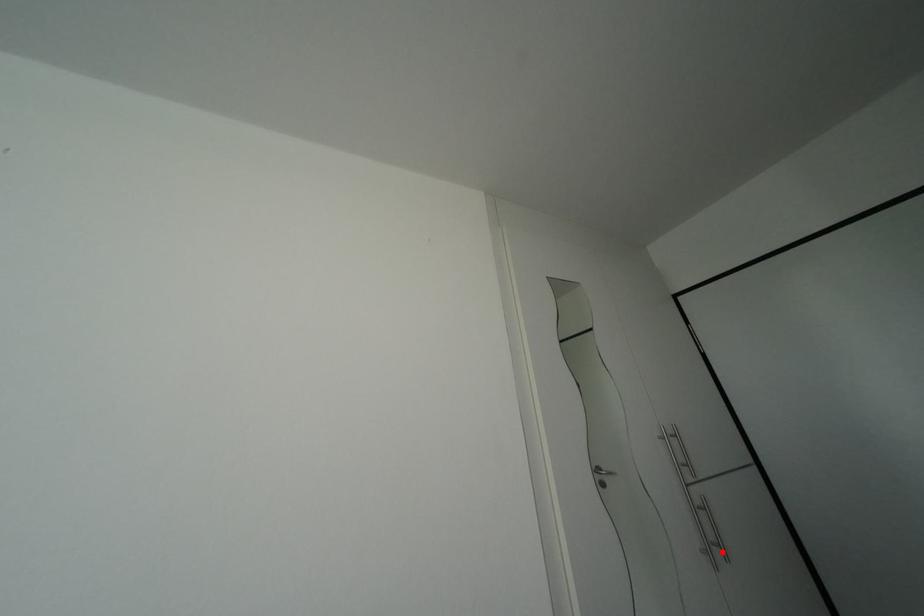
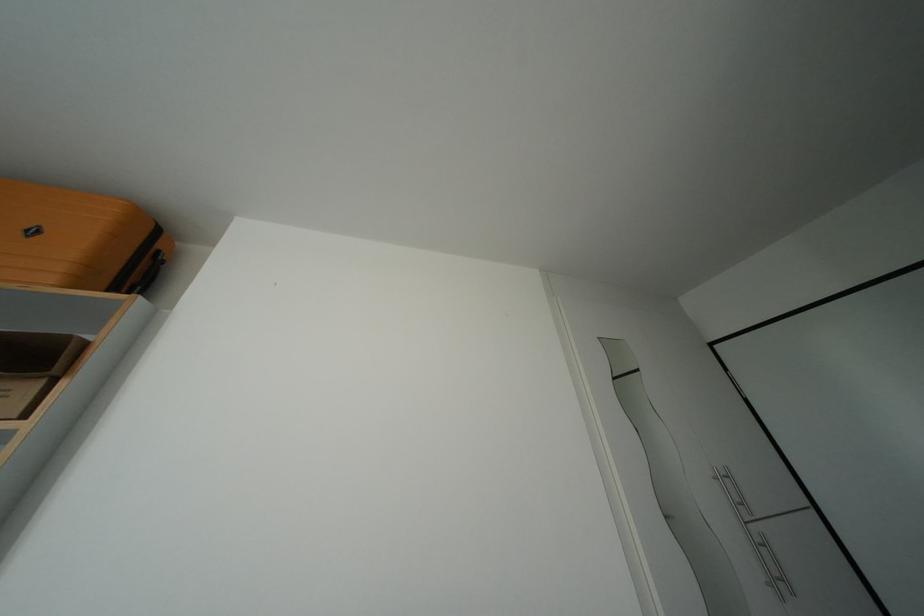
Question: I am providing you with two images of the same scene from different viewpoints. A red point is marked on the first image. Can you still see the location of the red point in image 2?

Choices:
 (A) Yes
 (B) No

Answer: (A)